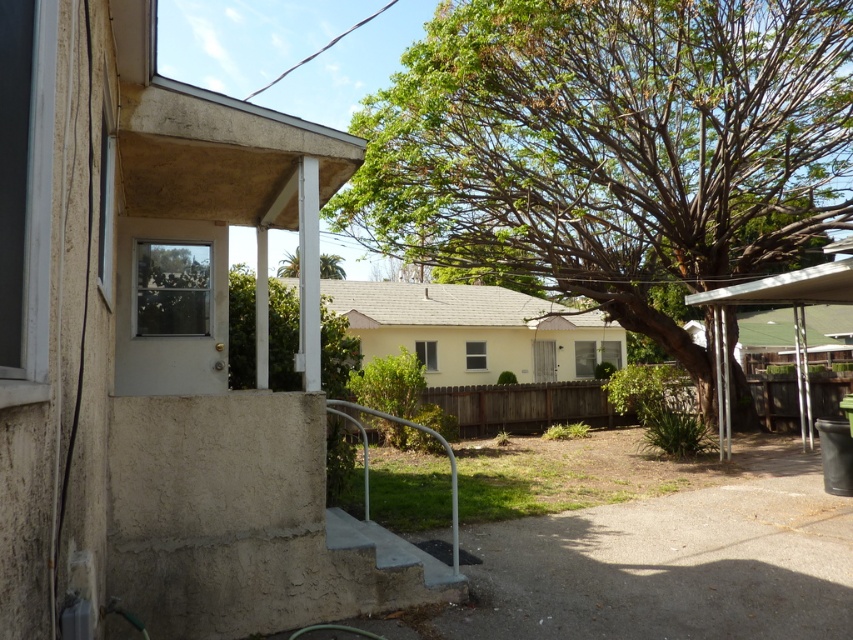
Is green leafy tree at center above green leafy tree at upper center?

Actually, green leafy tree at center is below green leafy tree at upper center.

Is green leafy tree at center thinner than green leafy tree at upper center?

In fact, green leafy tree at center might be wider than green leafy tree at upper center.

Is point (727, 189) farther from camera compared to point (289, 268)?

No, (727, 189) is closer to viewer.

Identify the location of green leafy tree at center. (613, 148).